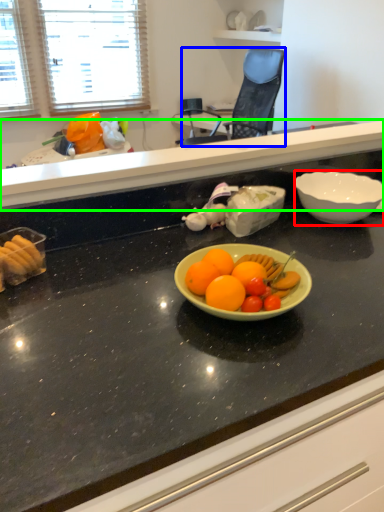
Question: Which object is the closest to the bowl (highlighted by a red box)? Choose among these: chair (highlighted by a blue box) or countertop (highlighted by a green box).

Choices:
 (A) chair
 (B) countertop

Answer: (B)